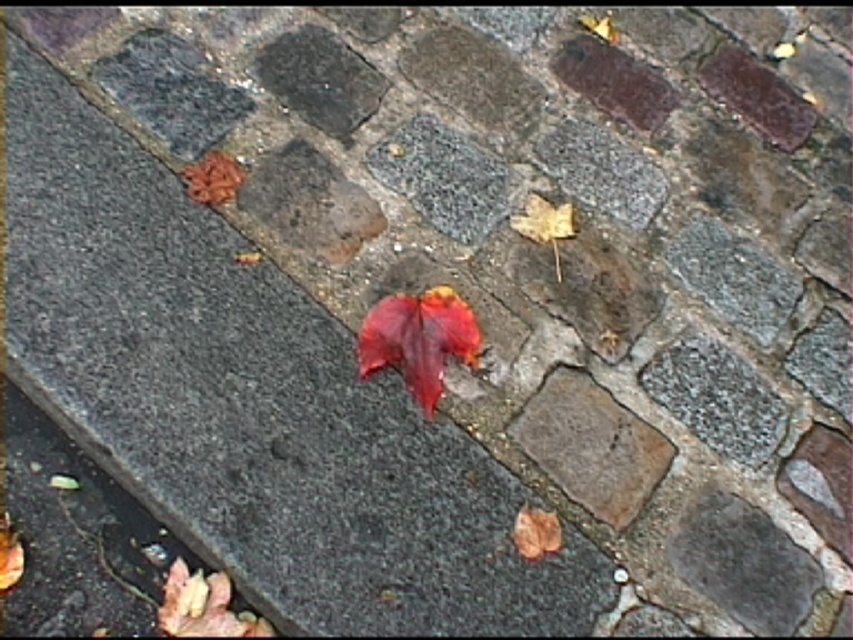
Is shiny red maple leaf at center above yellow matte maple leaf at upper right?

No, shiny red maple leaf at center is not above yellow matte maple leaf at upper right.

Does shiny red maple leaf at center have a lesser width compared to yellow matte maple leaf at upper right?

Incorrect, shiny red maple leaf at center's width is not less than yellow matte maple leaf at upper right's.

Which is behind, point (403, 321) or point (556, 252)?

Positioned behind is point (556, 252).

This screenshot has height=640, width=853. I want to click on shiny red maple leaf at center, so click(419, 339).

Is yellow matte maple leaf at upper right smaller than brown matte maple leaf at lower right?

No, yellow matte maple leaf at upper right is not smaller than brown matte maple leaf at lower right.

Is point (532, 220) positioned in front of point (527, 513)?

No, (532, 220) is behind (527, 513).

The image size is (853, 640). In order to click on yellow matte maple leaf at upper right in this screenshot , I will do `click(544, 225)`.

Is shiny red maple leaf at center taller than brown matte maple leaf at lower right?

Yes, shiny red maple leaf at center is taller than brown matte maple leaf at lower right.

Looking at this image, can you confirm if shiny red maple leaf at center is positioned below brown matte maple leaf at lower right?

Actually, shiny red maple leaf at center is above brown matte maple leaf at lower right.

Is point (434, 308) farther from camera compared to point (515, 531)?

Yes, it is.

You are a GUI agent. You are given a task and a screenshot of the screen. Output one action in this format:
    pyautogui.click(x=<x>, y=<y>)
    Task: Click on the shiny red maple leaf at center
    
    Given the screenshot: What is the action you would take?
    pyautogui.click(x=419, y=339)